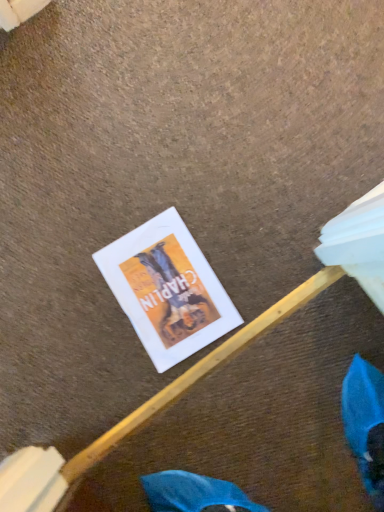
Locate an element on the screen. The image size is (384, 512). free space behind white paper book at center is located at coordinates (100, 202).